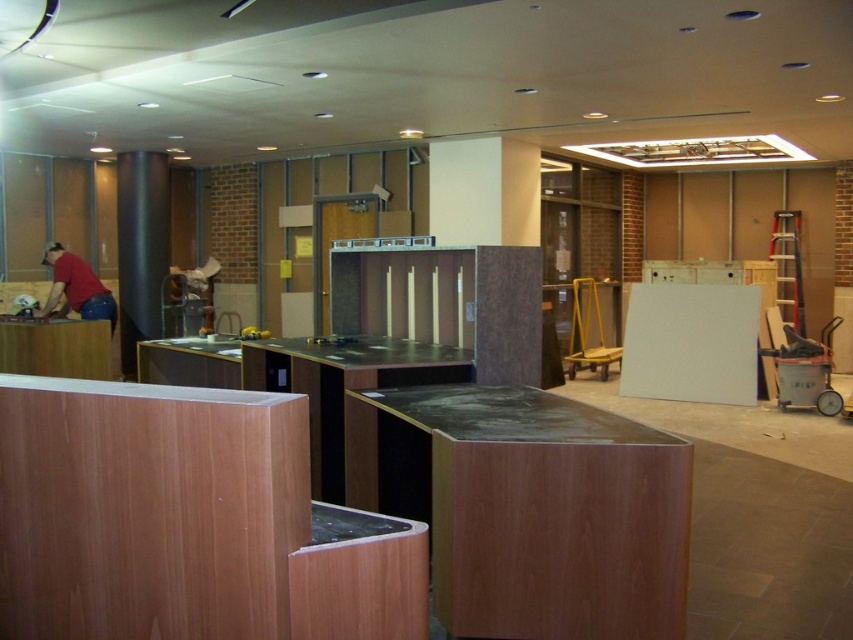
Does metallic gray column at left come in front of matte red shirt at left?

No, it is behind matte red shirt at left.

Find the location of a particular element. This screenshot has height=640, width=853. metallic gray column at left is located at coordinates (141, 248).

The height and width of the screenshot is (640, 853). Find the location of `metallic gray column at left`. metallic gray column at left is located at coordinates (141, 248).